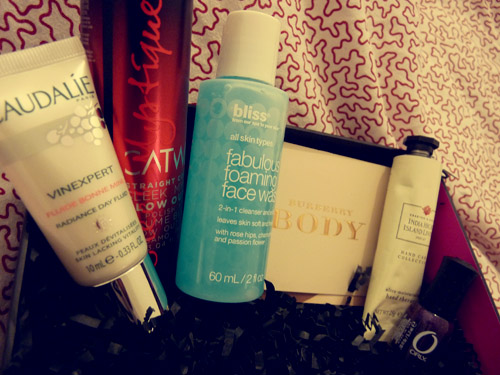
The image size is (500, 375). What are the coordinates of `makeup` in the screenshot? It's located at (86, 192), (230, 177), (139, 136), (316, 207), (416, 211).